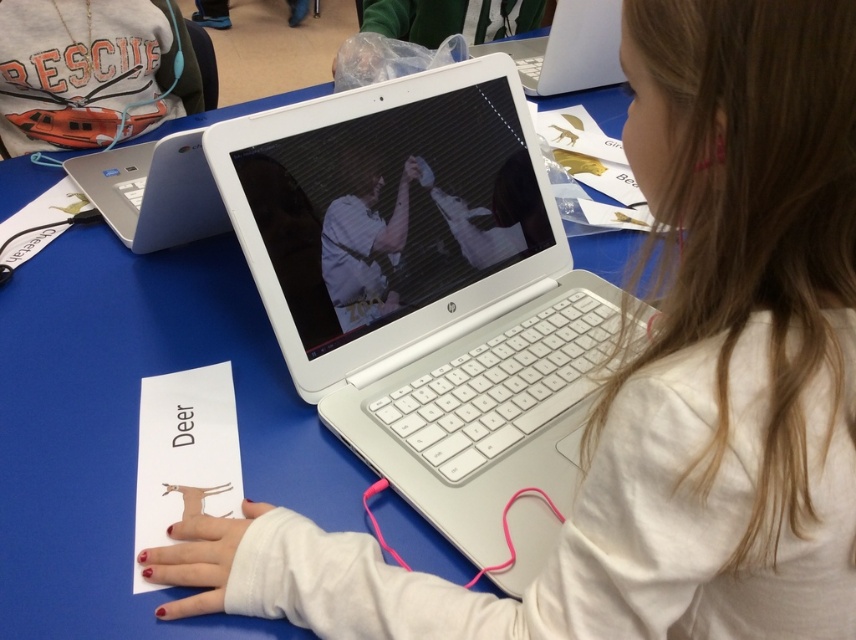
Which is behind, point (429, 125) or point (209, 44)?

The point (209, 44) is behind.

Is white plastic laptop at center thinner than matte orange lifeboat at upper left?

No, white plastic laptop at center is not thinner than matte orange lifeboat at upper left.

Between point (462, 72) and point (9, 90), which one is positioned behind?

Positioned behind is point (9, 90).

Find the location of a particular element. white plastic laptop at center is located at coordinates [423, 285].

Which of these two, matte orange lifeboat at upper left or white plastic laptop at upper center, stands shorter?

Standing shorter between the two is white plastic laptop at upper center.

Who is higher up, matte orange lifeboat at upper left or white plastic laptop at upper center?

white plastic laptop at upper center is above.

Is point (113, 129) behind point (614, 26)?

No, (113, 129) is in front of (614, 26).

Find the location of a particular element. matte orange lifeboat at upper left is located at coordinates (96, 72).

Consider the image. Is white plastic laptop at center in front of white plastic laptop at upper center?

Yes, it is.

Between white plastic laptop at center and white plastic laptop at upper center, which one appears on the right side from the viewer's perspective?

white plastic laptop at upper center

Which is in front, point (510, 317) or point (550, 58)?

Point (510, 317) is more forward.

At what (x,y) coordinates should I click in order to perform the action: click on white plastic laptop at center. Please return your answer as a coordinate pair (x, y). Image resolution: width=856 pixels, height=640 pixels. Looking at the image, I should click on [x=423, y=285].